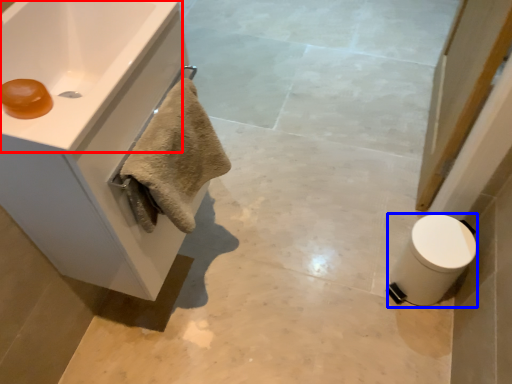
Question: Among these objects, which one is farthest to the camera, sink (highlighted by a red box) or toilet bowl (highlighted by a blue box)?

Choices:
 (A) sink
 (B) toilet bowl

Answer: (B)